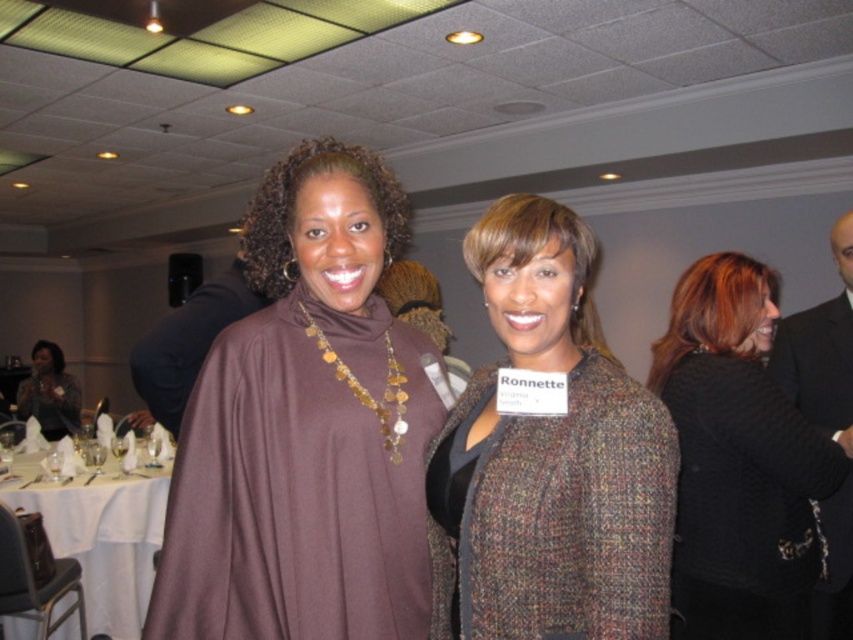
You are a photographer standing at the point marked as point (253, 573). You want to take a photo of the two women in the scene. Since you need to maintain a safe distance of at least 3 feet from the subjects, can you position yourself at this point to capture both women in the frame without moving them?

The two women are 3.37 feet apart. Since the photographer needs to maintain a safe distance of at least 3 feet from the subjects, positioning themselves at point (253, 573) would allow them to capture both women in the frame as the distance between them is sufficient.

From the picture: You are a photographer standing at the camera position. You want to take a closeup shot of the brown matte turtleneck sweater at center. Given that your camera has a minimum focusing distance of 0.5 meters, can you achieve this without moving closer?

The distance between the brown matte turtleneck sweater at center and the camera is 1.00 meters. Since the minimum focusing distance is 0.5 meters, the photographer can take the closeup shot without moving closer as the current distance is within the camera capabilities.